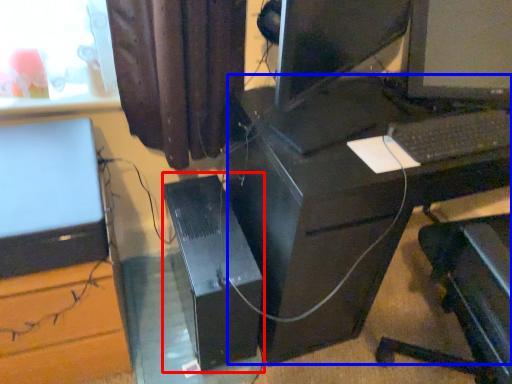
Question: Which of the following is the closest to the observer, computer tower (highlighted by a red box) or computer desk (highlighted by a blue box)?

Choices:
 (A) computer tower
 (B) computer desk

Answer: (B)